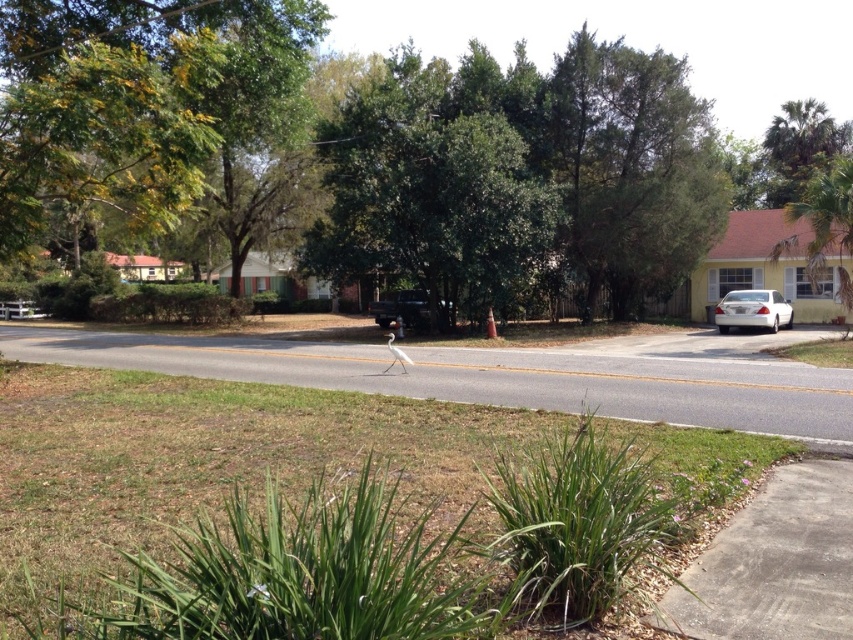
Measure the distance between point [780,307] and camera.

Point [780,307] and camera are 27.65 meters apart from each other.

In the scene shown: Who is positioned more to the left, white glossy sedan at right or matte black truck at center?

Positioned to the left is matte black truck at center.

Who is more forward, (x=735, y=301) or (x=374, y=316)?

Point (x=735, y=301) is in front.

I want to click on white glossy sedan at right, so click(x=752, y=310).

Can you confirm if green leafy palm tree at upper right is thinner than matte black truck at center?

In fact, green leafy palm tree at upper right might be wider than matte black truck at center.

Is point (770, 168) positioned before point (374, 308)?

That is False.

Which is behind, point (780, 186) or point (387, 301)?

The point (780, 186) is more distant.

Where is `green leafy palm tree at upper right`? The width and height of the screenshot is (853, 640). green leafy palm tree at upper right is located at coordinates (799, 147).

Between green leafy tree at upper left and green leafy tree at upper right, which one appears on the right side from the viewer's perspective?

From the viewer's perspective, green leafy tree at upper right appears more on the right side.

Measure the distance between green leafy tree at upper left and camera.

green leafy tree at upper left and camera are 11.77 meters apart.

Locate an element on the screen. This screenshot has width=853, height=640. green leafy tree at upper left is located at coordinates (142, 97).